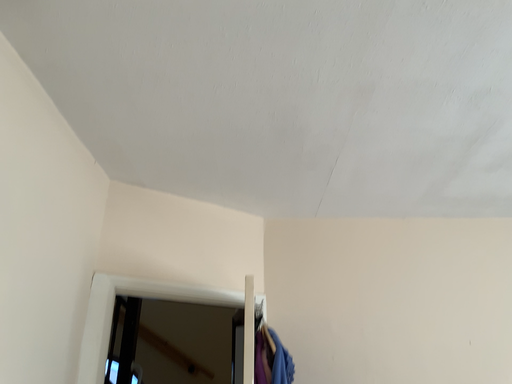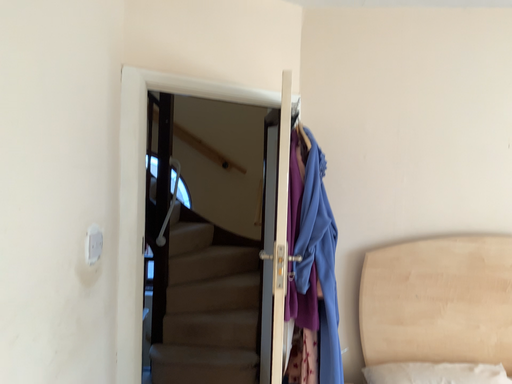
Question: How did the camera likely rotate when shooting the video?

Choices:
 (A) rotated downward
 (B) rotated upward

Answer: (A)